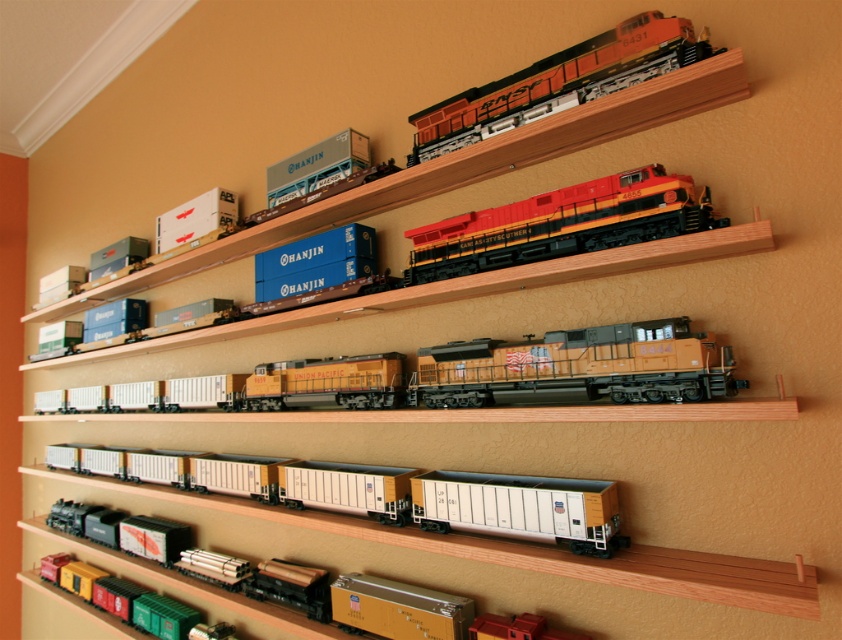
Question: Among these points, which one is farthest from the camera?

Choices:
 (A) (661, 54)
 (B) (244, 493)

Answer: (B)

Question: Among these points, which one is nearest to the camera?

Choices:
 (A) (565, 246)
 (B) (306, 497)
 (C) (502, 369)
 (D) (701, 596)

Answer: (D)

Question: Does white matte freight cars at center appear on the right side of metallic silver train car at center?

Choices:
 (A) yes
 (B) no

Answer: (A)

Question: Can you confirm if shiny red/black locomotive at center is bigger than metallic silver train car at center?

Choices:
 (A) yes
 (B) no

Answer: (B)

Question: Which point appears farthest from the camera in this image?

Choices:
 (A) (356, 404)
 (B) (411, 252)
 (C) (164, 572)

Answer: (C)

Question: Can you confirm if shiny red/black locomotive at center is wider than metallic silver train car at center?

Choices:
 (A) yes
 (B) no

Answer: (B)